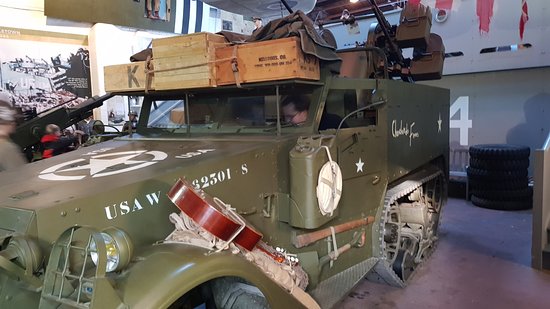
Locate an element on the screen. The image size is (550, 309). floor is located at coordinates [x=473, y=257].